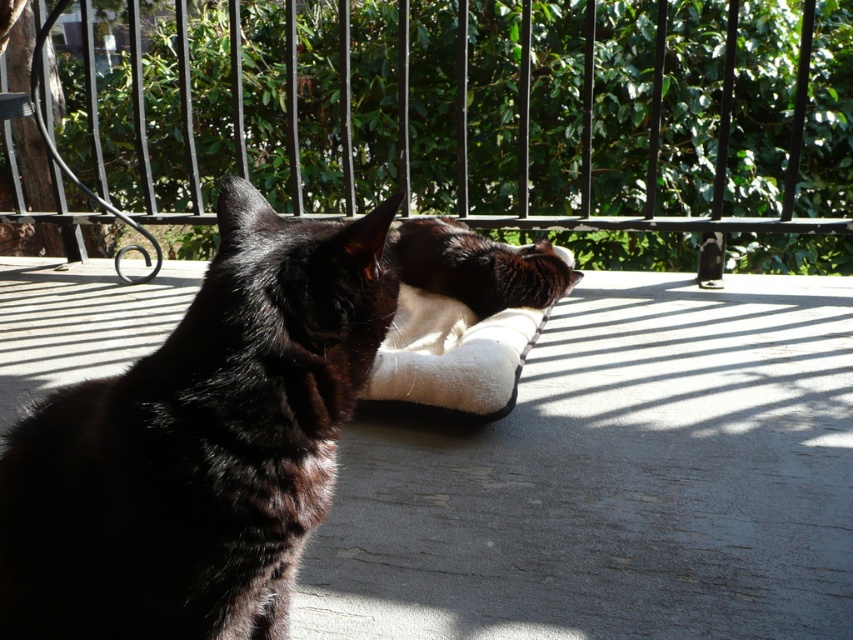
Who is positioned more to the right, black metal fence at upper center or black fur cat at center?

black fur cat at center is more to the right.

Does black metal fence at upper center have a smaller size compared to black fur cat at center?

No, black metal fence at upper center is not smaller than black fur cat at center.

Does point (206, 180) lie in front of point (438, 243)?

That is False.

This screenshot has width=853, height=640. I want to click on black metal fence at upper center, so click(x=480, y=116).

Between black soft cushion at center and black fur cat at center, which one is positioned lower?

black soft cushion at center

Does black soft cushion at center have a greater height compared to black fur cat at center?

Correct, black soft cushion at center is much taller as black fur cat at center.

Describe the element at coordinates (199, 444) in the screenshot. I see `black soft cushion at center` at that location.

Where is `black soft cushion at center`? This screenshot has height=640, width=853. black soft cushion at center is located at coordinates (199, 444).

Which is below, black metal fence at upper center or black soft cushion at center?

Positioned lower is black soft cushion at center.

Locate an element on the screen. This screenshot has height=640, width=853. black metal fence at upper center is located at coordinates (480, 116).

Where is `black metal fence at upper center`? The image size is (853, 640). black metal fence at upper center is located at coordinates (480, 116).